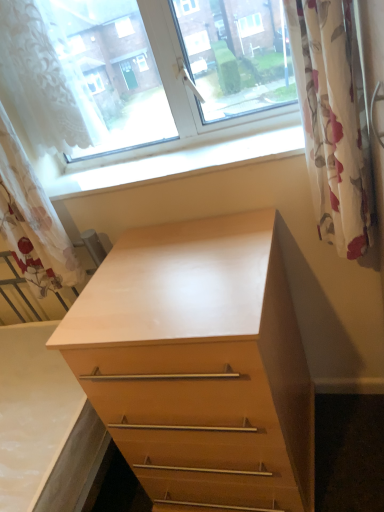
Find the location of `vacant point above white smooth window sill at upper center (from a real-world perspective)`. vacant point above white smooth window sill at upper center (from a real-world perspective) is located at coordinates (165, 160).